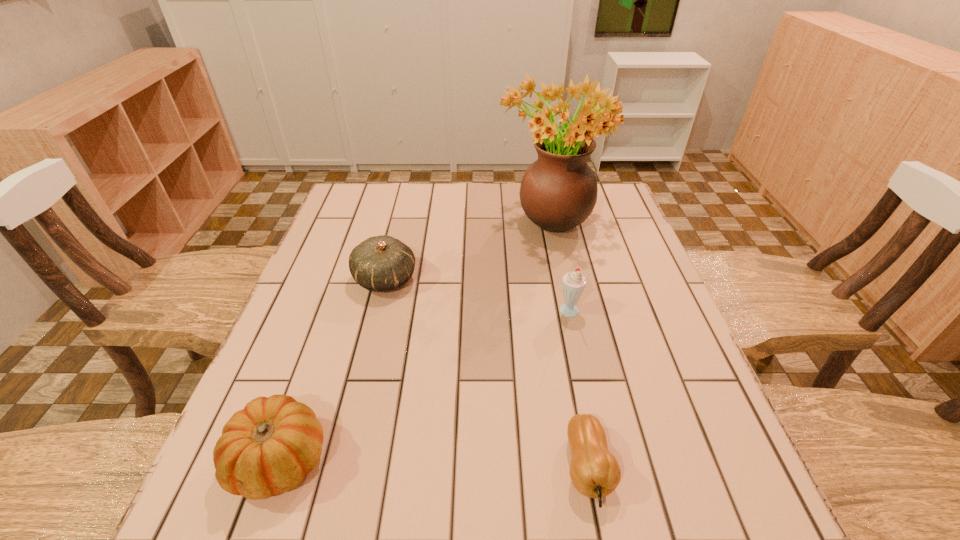
Identify which gourd is the second nearest to the second farthest object. Please provide its 2D coordinates. Your answer should be formatted as a tuple, i.e. [(x, y)], where the tuple contains the x and y coordinates of a point satisfying the conditions above.

[(594, 471)]

Find the location of a particular element. The image size is (960, 540). gourd object that ranks as the closest to the farthest object is located at coordinates (380, 263).

Image resolution: width=960 pixels, height=540 pixels. What are the coordinates of `vacant space that satisfies the following two spatial constraints: 1. on the straw side of the milkshake; 2. on the stem side of the rightmost gourd` in the screenshot? It's located at (603, 468).